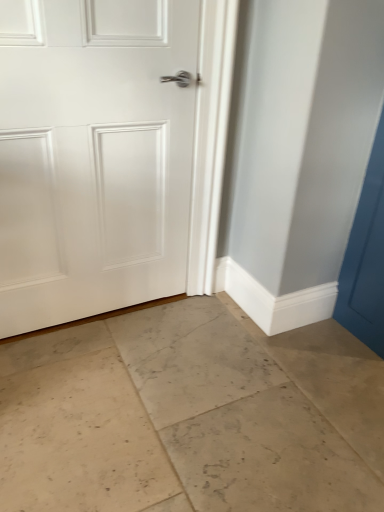
Locate an element on the screen. vacant space to the right of white matte door at center is located at coordinates (198, 344).